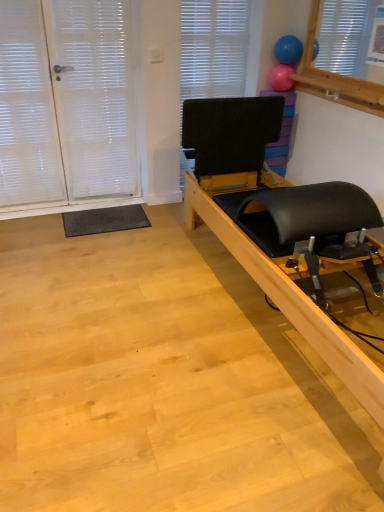
Question: From the image's perspective, is blue rubber balloon at upper right, the 2th balloon in the bottom-to-top sequence, located above or below black matte blind at upper center?

Choices:
 (A) below
 (B) above

Answer: (B)

Question: Visually, is blue rubber balloon at upper right, which is the first balloon from top to bottom, positioned to the left or to the right of black matte blind at upper center?

Choices:
 (A) right
 (B) left

Answer: (A)

Question: Considering the real-world distances, which object is closest to the black matte blind at upper center?

Choices:
 (A) white textured screen door at left
 (B) black leather pilates reformer at right
 (C) pink rubber balloon at upper center, acting as the 1th balloon starting from the bottom
 (D) blue rubber balloon at upper right, the 2th balloon in the bottom-to-top sequence

Answer: (C)

Question: Based on their relative distances, which object is nearer to the black leather pilates reformer at right?

Choices:
 (A) white textured screen door at left
 (B) pink rubber balloon at upper center, positioned as the second balloon in top-to-bottom order
 (C) black matte blind at upper center
 (D) blue rubber balloon at upper right, which is the first balloon from top to bottom

Answer: (C)